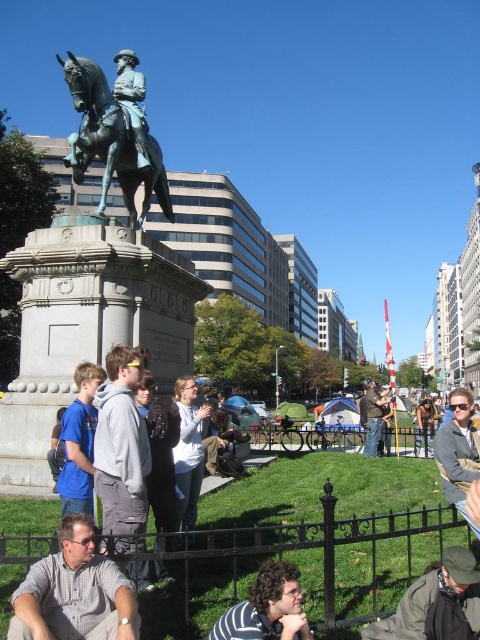
You are standing at the entrance of the park and want to locate the polished bronze statue at center. According to the coordinates provided, in which direction should you walk from your current position to reach it?

The polished bronze statue at center is located at coordinates point (110, 141), so you should walk towards the center of the park to reach it.

You are a photographer standing at the base of the polished bronze statue at center and want to take a photo of the blue cotton shirt at lower left. Which direction should you move to get the shirt in your frame?

The polished bronze statue at center is located above the blue cotton shirt at lower left, so you should move downward or to the lower left to position the blue cotton shirt at lower left within your camera frame.